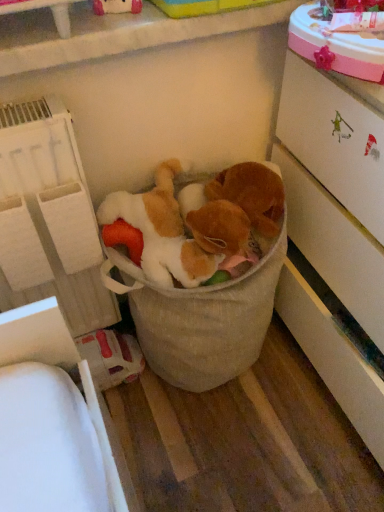
Question: Can you confirm if fluffy beige stuffed animals at center is shorter than white glossy cabinet at right?

Choices:
 (A) yes
 (B) no

Answer: (A)

Question: From a real-world perspective, is fluffy beige stuffed animals at center below white glossy cabinet at right?

Choices:
 (A) yes
 (B) no

Answer: (A)

Question: Is fluffy beige stuffed animals at center thinner than white glossy cabinet at right?

Choices:
 (A) no
 (B) yes

Answer: (B)

Question: Is fluffy beige stuffed animals at center at the left side of white glossy cabinet at right?

Choices:
 (A) yes
 (B) no

Answer: (A)

Question: Can we say fluffy beige stuffed animals at center lies outside white glossy cabinet at right?

Choices:
 (A) no
 (B) yes

Answer: (B)

Question: Considering the positions of fluffy beige stuffed animals at center and white glossy cabinet at right in the image, is fluffy beige stuffed animals at center taller or shorter than white glossy cabinet at right?

Choices:
 (A) short
 (B) tall

Answer: (A)

Question: From a real-world perspective, is fluffy beige stuffed animals at center physically located above or below white glossy cabinet at right?

Choices:
 (A) below
 (B) above

Answer: (A)

Question: From the image's perspective, is fluffy beige stuffed animals at center positioned above or below white glossy cabinet at right?

Choices:
 (A) above
 (B) below

Answer: (B)

Question: Considering their positions, is fluffy beige stuffed animals at center located in front of or behind white glossy cabinet at right?

Choices:
 (A) behind
 (B) front

Answer: (A)

Question: From the image's perspective, relative to white textured shelf at left, is fluffy beige stuffed animals at center above or below?

Choices:
 (A) below
 (B) above

Answer: (A)

Question: In terms of size, does fluffy beige stuffed animals at center appear bigger or smaller than white textured shelf at left?

Choices:
 (A) big
 (B) small

Answer: (A)

Question: Is fluffy beige stuffed animals at center wider or thinner than white textured shelf at left?

Choices:
 (A) thin
 (B) wide

Answer: (B)

Question: Choose the correct answer: Is fluffy beige stuffed animals at center inside white textured shelf at left or outside it?

Choices:
 (A) outside
 (B) inside

Answer: (A)

Question: Looking at their shapes, would you say white textured shelf at left is wider or thinner than fluffy beige stuffed animals at center?

Choices:
 (A) wide
 (B) thin

Answer: (B)

Question: From their relative heights in the image, would you say white textured shelf at left is taller or shorter than fluffy beige stuffed animals at center?

Choices:
 (A) tall
 (B) short

Answer: (A)